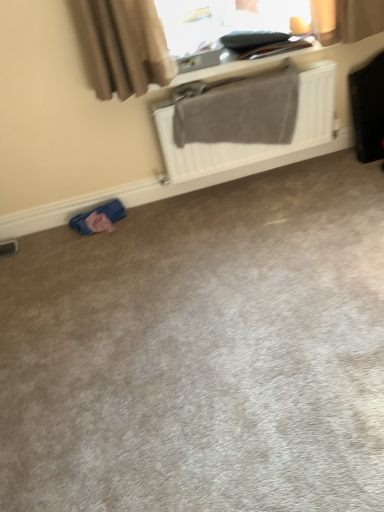
This screenshot has width=384, height=512. Find the location of `white matte radiator at upper center`. white matte radiator at upper center is located at coordinates (255, 144).

Locate an element on the screen. blue fabric at lower left is located at coordinates click(x=99, y=218).

Locate an element on the screen. The height and width of the screenshot is (512, 384). material that appears on the left of gray carpet at lower left is located at coordinates (99, 218).

Could blue fabric at lower left be considered to be inside gray carpet at lower left?

No, blue fabric at lower left is not a part of gray carpet at lower left.

From their relative heights in the image, would you say gray carpet at lower left is taller or shorter than blue fabric at lower left?

In the image, gray carpet at lower left appears to be shorter than blue fabric at lower left.

From the picture: Is gray carpet at lower left far from blue fabric at lower left?

No.

Between white matte radiator at upper center and gray carpet at lower left, which one has less height?

With less height is gray carpet at lower left.

Locate an element on the screen. This screenshot has height=512, width=384. radiator that appears above the gray carpet at lower left (from the image's perspective) is located at coordinates (255, 144).

Between point (218, 144) and point (360, 490), which one is positioned behind?

The point (218, 144) is farther from the camera.

What's the angular difference between white matte radiator at upper center and gray carpet at lower left's facing directions?

87.4 degrees.

Who is more distant, beige fabric curtain at upper left or white matte radiator at upper center?

Positioned behind is white matte radiator at upper center.

Considering the sizes of beige fabric curtain at upper left and white matte radiator at upper center in the image, is beige fabric curtain at upper left bigger or smaller than white matte radiator at upper center?

In the image, beige fabric curtain at upper left appears to be smaller than white matte radiator at upper center.

Based on the photo, from a real-world perspective, is beige fabric curtain at upper left on top of white matte radiator at upper center?

Indeed, from a real-world perspective, beige fabric curtain at upper left stands above white matte radiator at upper center.

Is beige fabric curtain at upper left situated inside white matte radiator at upper center or outside?

beige fabric curtain at upper left lies outside white matte radiator at upper center.

Is white matte radiator at upper center closer to the viewer compared to beige fabric curtain at upper left?

No, the depth of white matte radiator at upper center is greater than that of beige fabric curtain at upper left.

Which is behind, point (228, 155) or point (136, 0)?

Point (228, 155)

Is white matte radiator at upper center far from beige fabric curtain at upper left?

white matte radiator at upper center is actually quite close to beige fabric curtain at upper left.

Between white matte radiator at upper center and beige fabric curtain at upper left, which one appears on the left side from the viewer's perspective?

beige fabric curtain at upper left.

From the image's perspective, between black leather suitcase at right and beige fabric curtain at upper left, which one is located above?

From the image's view, beige fabric curtain at upper left is above.

Is point (372, 146) positioned behind point (151, 59)?

Yes, point (372, 146) is farther from viewer.

Between black leather suitcase at right and beige fabric curtain at upper left, which one has larger size?

black leather suitcase at right.

Is black leather suitcase at right inside or outside of beige fabric curtain at upper left?

Result: black leather suitcase at right is not enclosed by beige fabric curtain at upper left.

Which of these two, beige fabric curtain at upper left or black leather suitcase at right, is wider?

black leather suitcase at right is wider.

Is beige fabric curtain at upper left in front of or behind black leather suitcase at right in the image?

Visually, beige fabric curtain at upper left is located in front of black leather suitcase at right.

Identify the location of luggage that is under the beige fabric curtain at upper left (from a real-world perspective). (368, 109).

Where is `luggage on the right of the gray carpet at lower left`? This screenshot has width=384, height=512. luggage on the right of the gray carpet at lower left is located at coordinates (368, 109).

Which is closer to the camera, (x=378, y=83) or (x=112, y=360)?

Point (x=112, y=360)

Is black leather suitcase at right touching gray carpet at lower left?

No, black leather suitcase at right is not with gray carpet at lower left.

Is black leather suitcase at right bigger or smaller than gray carpet at lower left?

Considering their sizes, black leather suitcase at right takes up less space than gray carpet at lower left.

Where is `material above the gray carpet at lower left (from the image's perspective)`? material above the gray carpet at lower left (from the image's perspective) is located at coordinates (99, 218).

The image size is (384, 512). What are the coordinates of `concrete on the left of the white matte radiator at upper center` in the screenshot? It's located at (202, 351).

Based on their spatial positions, is beige fabric curtain at upper left or white matte radiator at upper center further from black leather suitcase at right?

beige fabric curtain at upper left.

Which object lies nearer to the anchor point beige fabric curtain at upper left, gray carpet at lower left or blue fabric at lower left?

The object closer to beige fabric curtain at upper left is blue fabric at lower left.

Which object lies nearer to the anchor point white matte radiator at upper center, beige fabric curtain at upper left or blue fabric at lower left?

The object closer to white matte radiator at upper center is beige fabric curtain at upper left.

When comparing their distances from blue fabric at lower left, does black leather suitcase at right or gray carpet at lower left seem further?

black leather suitcase at right is positioned further to the anchor blue fabric at lower left.

Which object lies nearer to the anchor point beige fabric curtain at upper left, white matte radiator at upper center or black leather suitcase at right?

white matte radiator at upper center is positioned closer to the anchor beige fabric curtain at upper left.

Looking at the image, which one is located further to blue fabric at lower left, gray carpet at lower left or beige fabric curtain at upper left?

Among the two, gray carpet at lower left is located further to blue fabric at lower left.

Looking at the image, which one is located further to black leather suitcase at right, gray carpet at lower left or white matte radiator at upper center?

gray carpet at lower left lies further to black leather suitcase at right than the other object.

When comparing their distances from white matte radiator at upper center, does black leather suitcase at right or beige fabric curtain at upper left seem closer?

Among the two, black leather suitcase at right is located nearer to white matte radiator at upper center.

This screenshot has width=384, height=512. I want to click on curtain located between blue fabric at lower left and white matte radiator at upper center in the left-right direction, so click(123, 46).

This screenshot has width=384, height=512. Identify the location of radiator located between beige fabric curtain at upper left and black leather suitcase at right in the left-right direction. (255, 144).

Image resolution: width=384 pixels, height=512 pixels. In order to click on concrete located between beige fabric curtain at upper left and black leather suitcase at right in the left-right direction in this screenshot , I will do `click(202, 351)`.

Identify the location of curtain between gray carpet at lower left and blue fabric at lower left in the front-back direction. This screenshot has height=512, width=384. (123, 46).